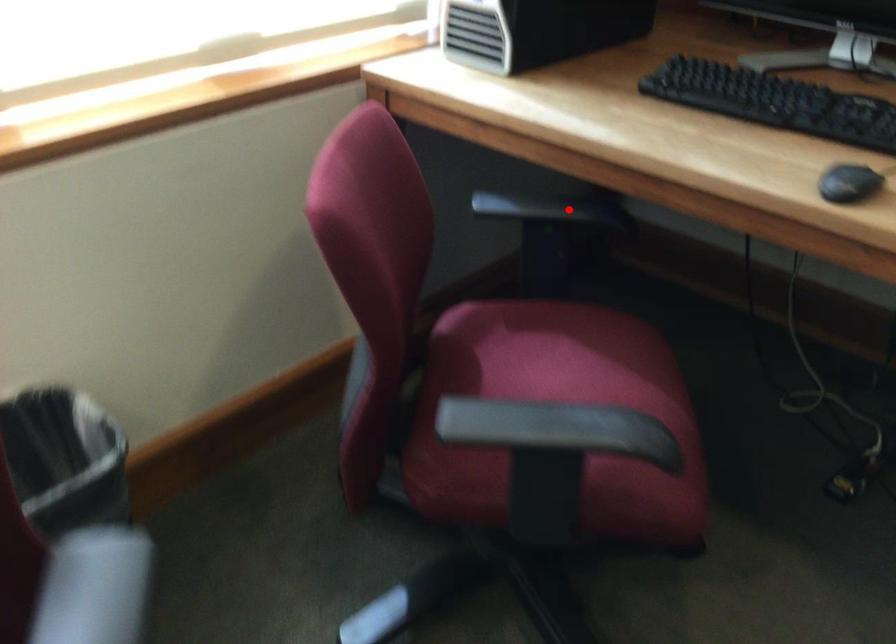
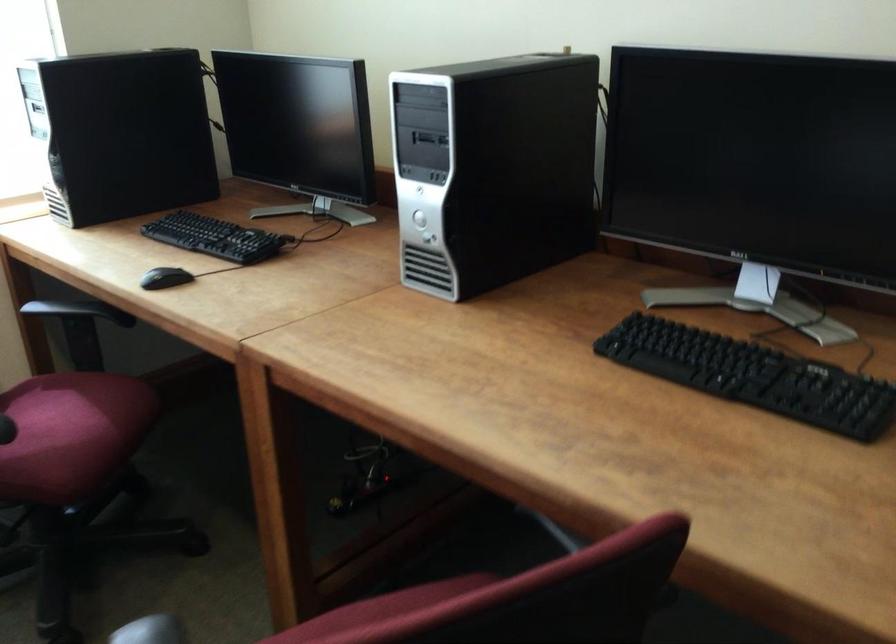
Locate, in the second image, the point that corresponds to the highlighted location in the first image.

(74, 310)